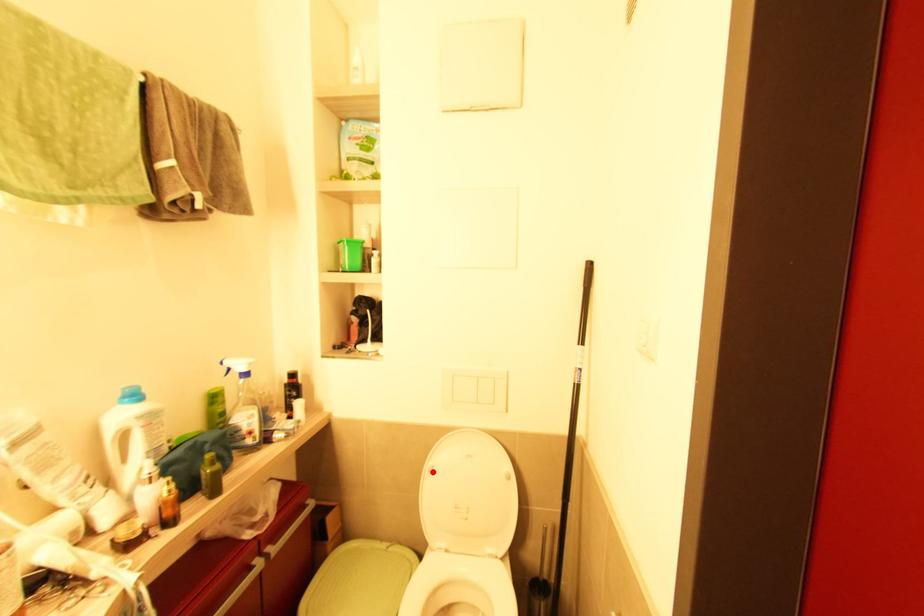
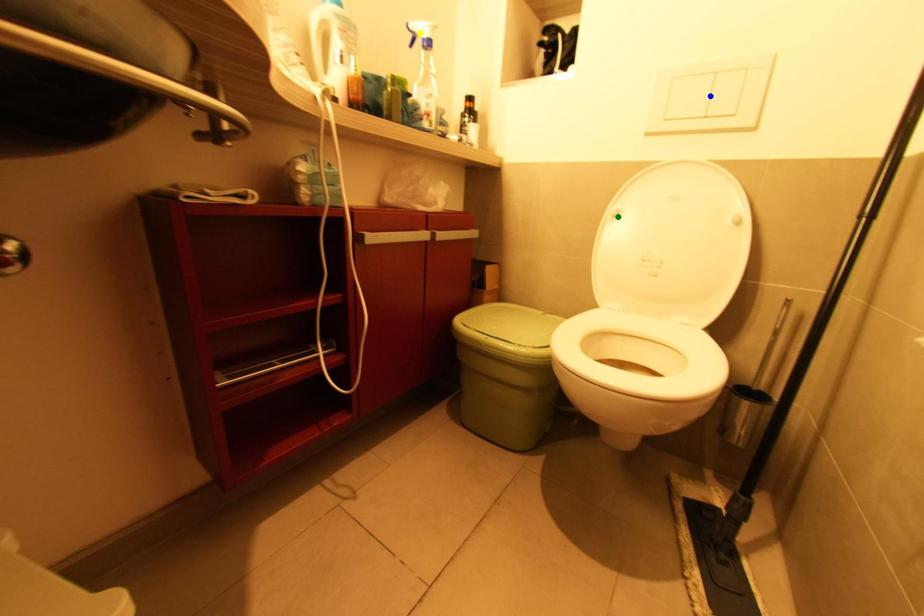
Question: I am providing you with two images of the same scene from different viewpoints. A red point is marked on the first image. You are given multiple points on the second image. Which point in image 2 is actually the same real-world point as the red point in image 1?

Choices:
 (A) yellow point
 (B) blue point
 (C) green point

Answer: (C)